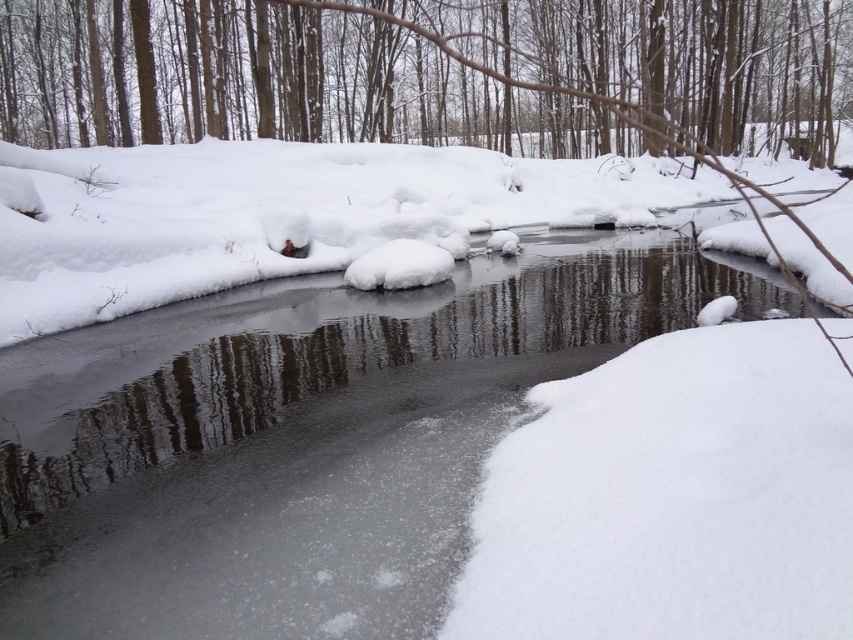
You are an explorer in the winter forest. You see the clear ice stream at center and the smooth bark tree at upper center. Which object is positioned to the right side of the other?

The smooth bark tree at upper center is positioned to the right of the clear ice stream at center.